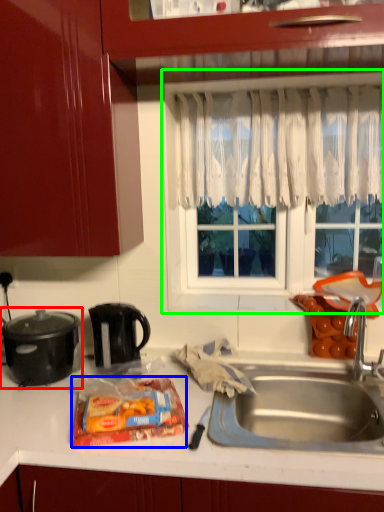
Question: Estimate the real-world distances between objects in this image. Which object is farther from kitchen appliance (highlighted by a red box), snack (highlighted by a blue box) or window frame (highlighted by a green box)?

Choices:
 (A) snack
 (B) window frame

Answer: (B)